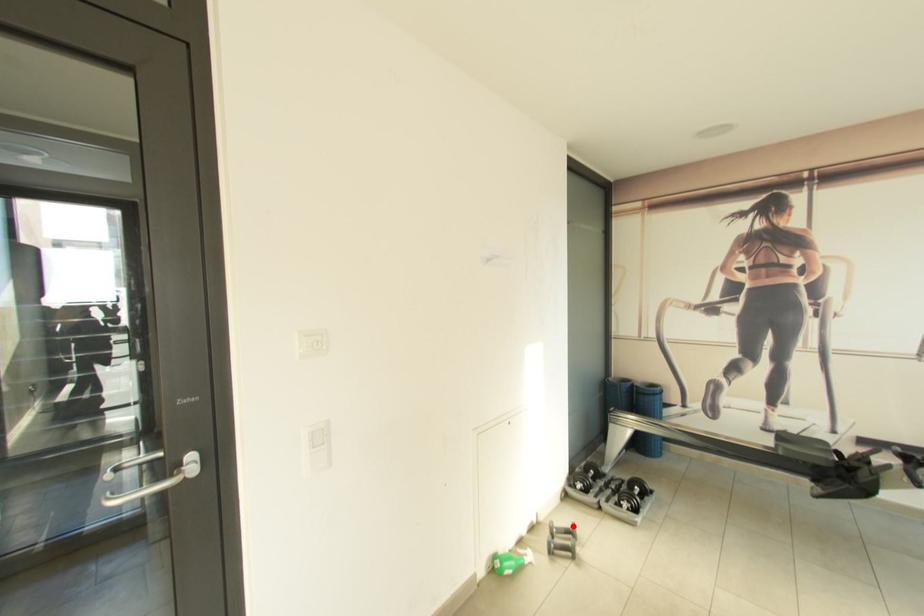
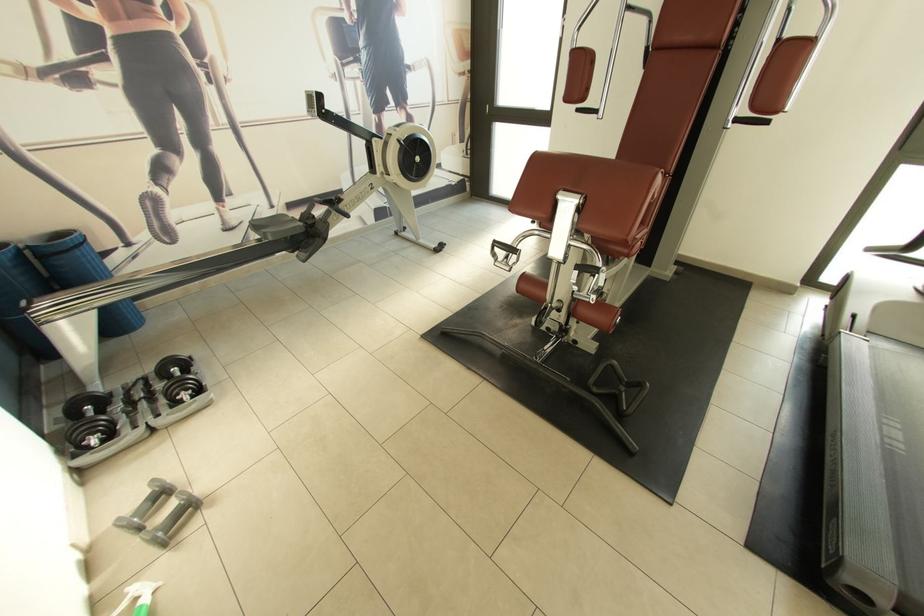
Question: I am providing you with two images of the same scene from different viewpoints. In image1, a red point is highlighted. Considering the same 3D point in image2, which of the following is correct?

Choices:
 (A) It is closer
 (B) It is farther

Answer: (B)